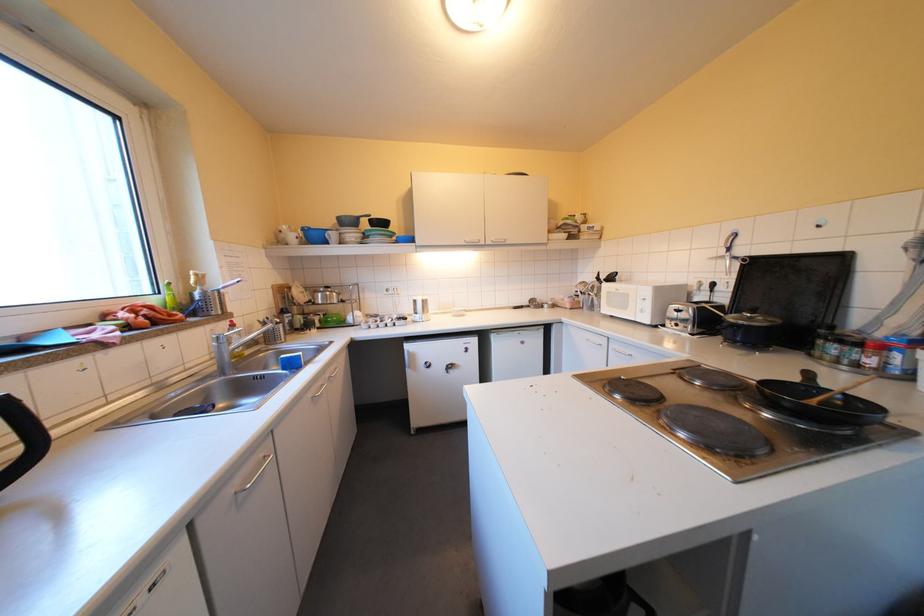
This screenshot has width=924, height=616. What do you see at coordinates (22, 438) in the screenshot? I see `the pot lid handle` at bounding box center [22, 438].